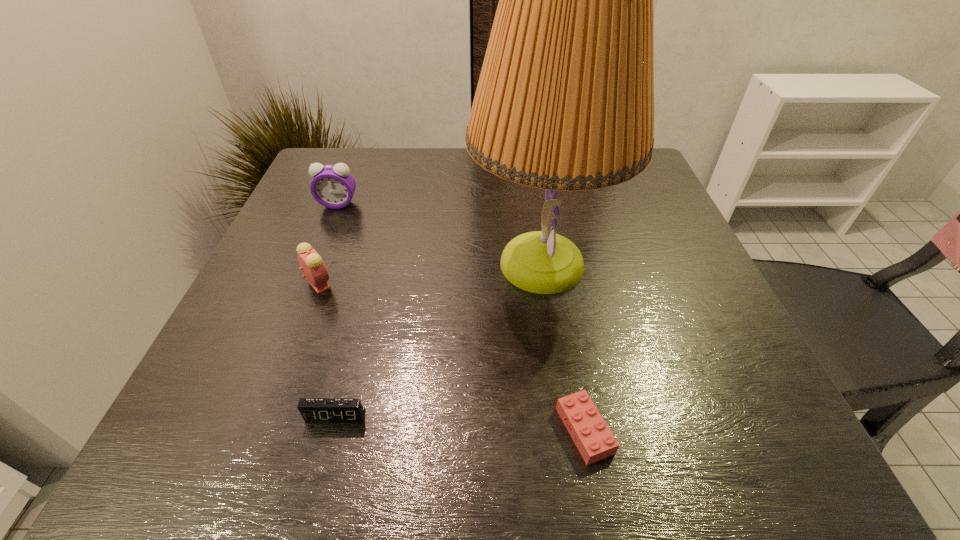
This screenshot has height=540, width=960. In the image, there is a desktop. What are the coordinates of `free space at the right edge` in the screenshot? It's located at (682, 284).

Where is `free spot at the far left corner of the desktop`? This screenshot has width=960, height=540. free spot at the far left corner of the desktop is located at coordinates 307,177.

Locate an element on the screen. The height and width of the screenshot is (540, 960). free space at the near right corner of the desktop is located at coordinates (701, 455).

Identify the location of free spot between the tallest object and the third tallest object. The width and height of the screenshot is (960, 540). (430, 273).

The height and width of the screenshot is (540, 960). Find the location of `vacant space in between the shortest object and the nearest alarm clock`. vacant space in between the shortest object and the nearest alarm clock is located at coordinates (460, 423).

Identify the location of free spot between the Lego and the lamp. (564, 347).

Locate an element on the screen. This screenshot has height=540, width=960. free space that is in between the rightmost alarm clock and the tallest object is located at coordinates (439, 340).

The height and width of the screenshot is (540, 960). I want to click on vacant area that lies between the third tallest object and the Lego, so click(451, 357).

Find the location of a particular element. The image size is (960, 540). unoccupied position between the second shortest object and the Lego is located at coordinates point(460,423).

The width and height of the screenshot is (960, 540). Find the location of `free area in between the Lego and the second shortest object`. free area in between the Lego and the second shortest object is located at coordinates (460, 423).